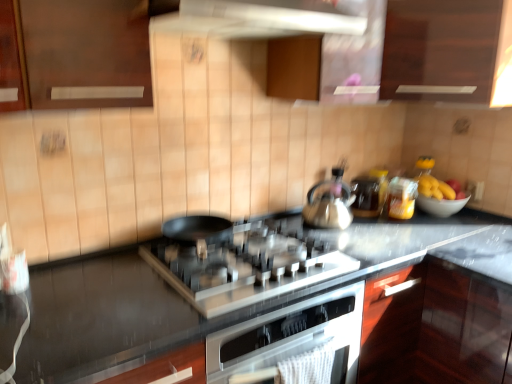
Identify the location of vacant space in front of matte glass jar at center, which is counted as the 2th appliance, starting from the right. Image resolution: width=512 pixels, height=384 pixels. (375, 223).